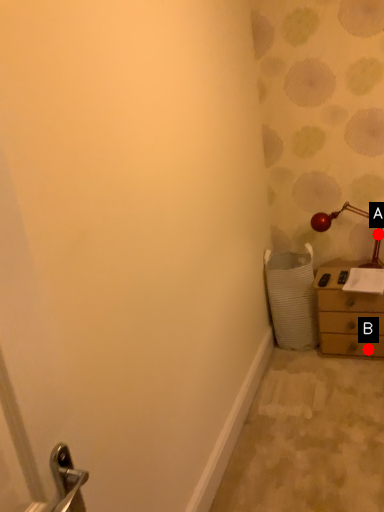
Question: Two points are circled on the image, labeled by A and B beside each circle. Which point is closer to the camera taking this photo?

Choices:
 (A) A is closer
 (B) B is closer

Answer: (B)